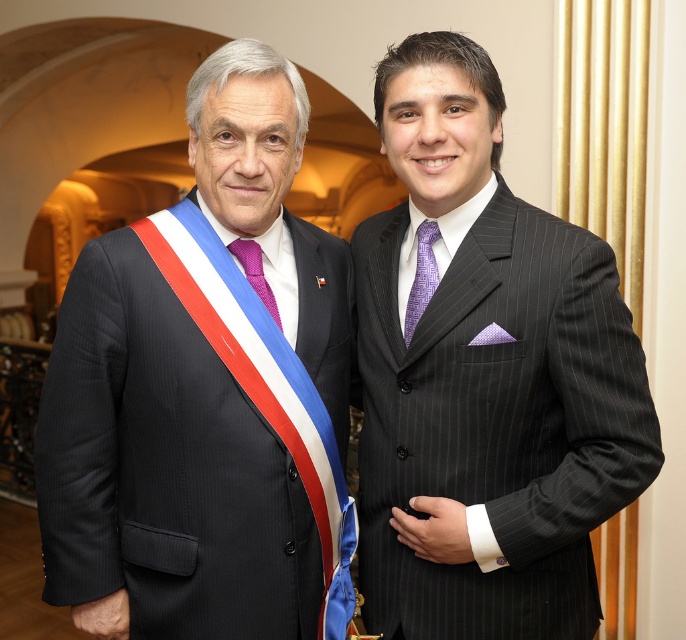
Question: Does matte black suit at left appear on the left side of purple silk tie at center?

Choices:
 (A) yes
 (B) no

Answer: (A)

Question: Which is nearer to the purple silk tie at center?

Choices:
 (A) purple knitted tie at center
 (B) pinstriped suit at right

Answer: (B)

Question: Which point appears closest to the camera in this image?

Choices:
 (A) (67, 348)
 (B) (228, 243)

Answer: (A)

Question: Considering the relative positions of matte black suit at left and purple silk tie at center in the image provided, where is matte black suit at left located with respect to purple silk tie at center?

Choices:
 (A) right
 (B) left

Answer: (B)

Question: Does pinstriped suit at right have a larger size compared to purple silk tie at center?

Choices:
 (A) no
 (B) yes

Answer: (B)

Question: Which of the following is the closest to the observer?

Choices:
 (A) (248, 273)
 (B) (423, 243)
 (C) (311, 404)

Answer: (C)